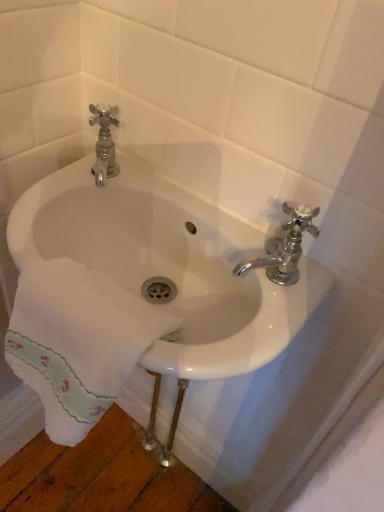
This screenshot has width=384, height=512. Find the location of `vacant area that is in front of chrome metallic faucet at upper right`. vacant area that is in front of chrome metallic faucet at upper right is located at coordinates (255, 328).